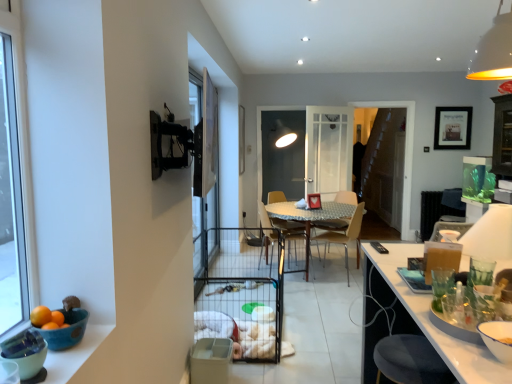
Find the location of a particular element. free space on the front side of light brown wood chair at center, which ranks as the 2th chair in left-to-right order is located at coordinates (336, 286).